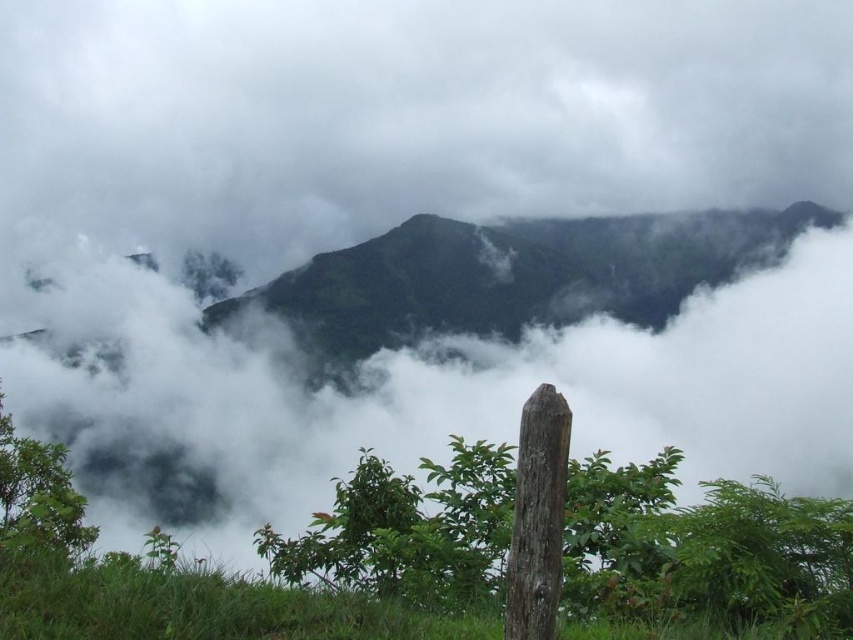
Question: Which point appears closest to the camera in this image?

Choices:
 (A) (343, 253)
 (B) (524, 557)

Answer: (B)

Question: Is green matte mountain at center to the right of brown rough wood pole at center from the viewer's perspective?

Choices:
 (A) yes
 (B) no

Answer: (A)

Question: Can you confirm if green matte mountain at center is smaller than brown rough wood pole at center?

Choices:
 (A) no
 (B) yes

Answer: (A)

Question: Which of the following is the farthest from the observer?

Choices:
 (A) (579, 296)
 (B) (508, 637)

Answer: (A)

Question: Is green matte mountain at center to the left of brown rough wood pole at center from the viewer's perspective?

Choices:
 (A) no
 (B) yes

Answer: (A)